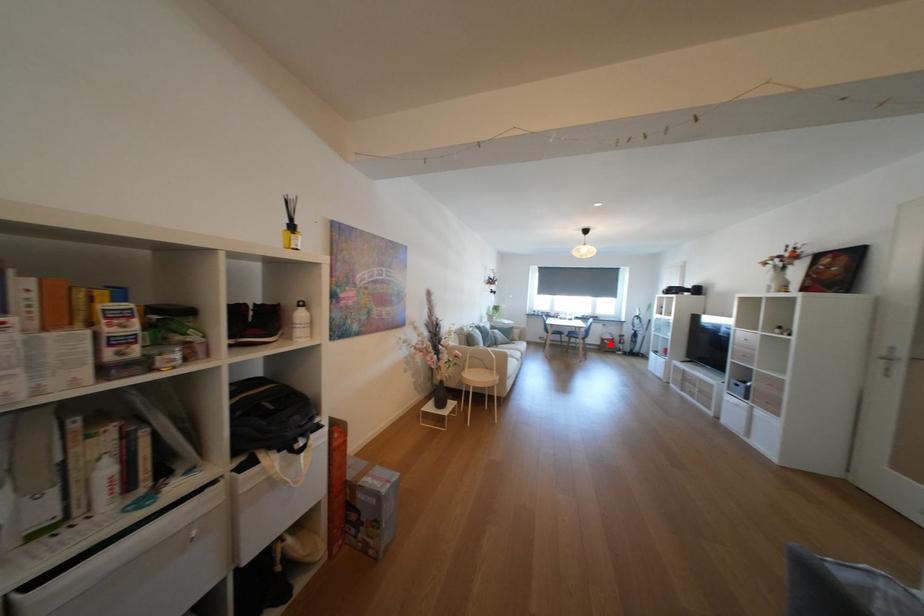
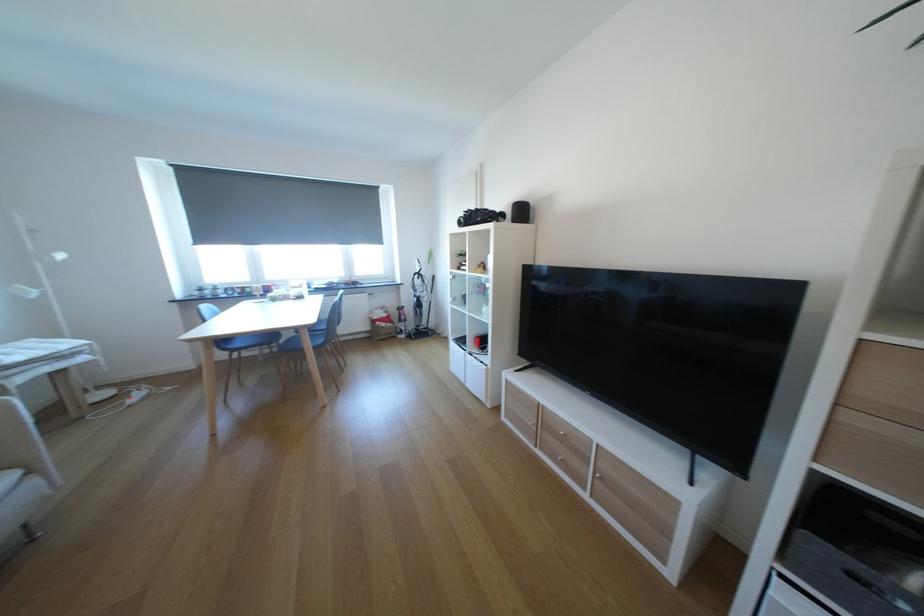
Question: I am providing you with two images of the same scene from different viewpoints. Image1 has a red point marked. In image2, the corresponding 3D location appears at what relative position? Reply with the corresponding letter.

Choices:
 (A) Closer
 (B) Farther

Answer: (A)